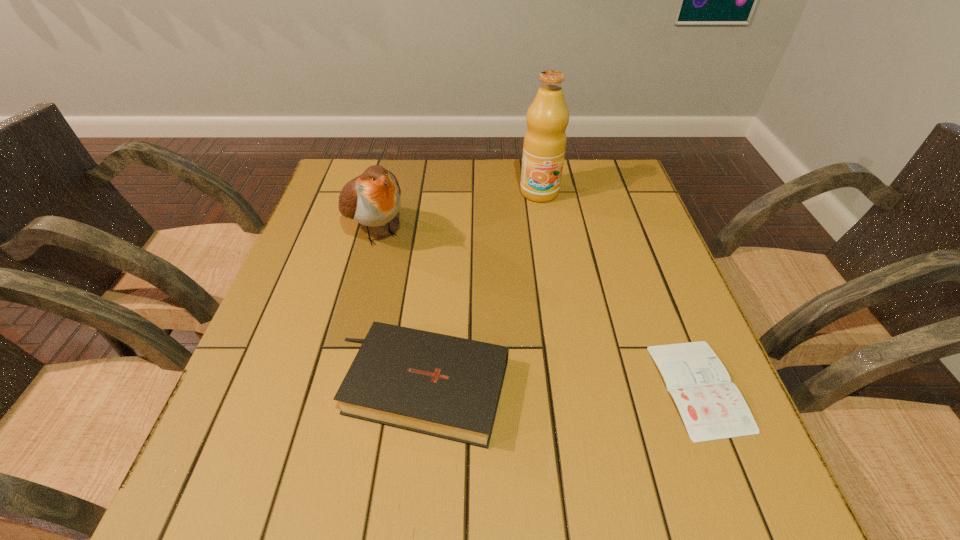
Where is `Bible`? This screenshot has height=540, width=960. Bible is located at coordinates (449, 387).

At what (x,y) coordinates should I click in order to perform the action: click on diary. Please return your answer as a coordinate pair (x, y). Looking at the image, I should click on (712, 408).

Where is `the rightmost object`? the rightmost object is located at coordinates (712, 408).

At what (x,y) coordinates should I click in order to perform the action: click on the second farthest object. Please return your answer as a coordinate pair (x, y). The width and height of the screenshot is (960, 540). Looking at the image, I should click on (373, 199).

The height and width of the screenshot is (540, 960). In order to click on the third shortest object in this screenshot , I will do `click(373, 199)`.

At what (x,y) coordinates should I click in order to perform the action: click on the tallest object. Please return your answer as a coordinate pair (x, y). Image resolution: width=960 pixels, height=540 pixels. Looking at the image, I should click on (544, 146).

Find the location of a particular element. The width and height of the screenshot is (960, 540). the second object from right to left is located at coordinates (544, 146).

You are a GUI agent. You are given a task and a screenshot of the screen. Output one action in this format:
    pyautogui.click(x=<x>, y=<y>)
    Task: Click on the free space located 0.140m on the back of the Bible
    The image size is (960, 540).
    Given the screenshot: What is the action you would take?
    pyautogui.click(x=431, y=287)

Locate an element on the screen. The height and width of the screenshot is (540, 960). free space located 0.160m on the left of the shortest object is located at coordinates (572, 387).

The image size is (960, 540). Identify the location of vacant region located at the face of the bird. (488, 361).